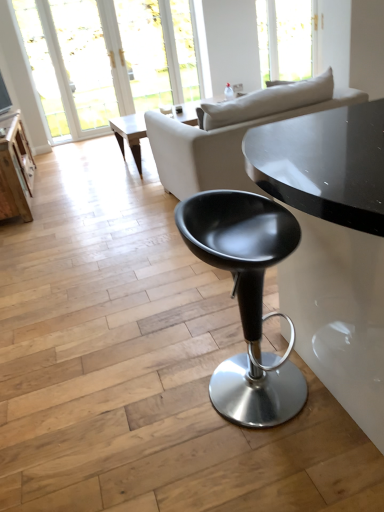
Question: Is transparent glass window at upper center further to the viewer compared to transparent glass door at upper left?

Choices:
 (A) yes
 (B) no

Answer: (A)

Question: Does transparent glass window at upper center appear on the left side of transparent glass door at upper left?

Choices:
 (A) no
 (B) yes

Answer: (A)

Question: Is transparent glass window at upper center closer to camera compared to transparent glass door at upper left?

Choices:
 (A) yes
 (B) no

Answer: (B)

Question: Considering the relative sizes of transparent glass window at upper center and transparent glass door at upper left in the image provided, is transparent glass window at upper center shorter than transparent glass door at upper left?

Choices:
 (A) no
 (B) yes

Answer: (B)

Question: Considering the relative sizes of transparent glass window at upper center and transparent glass door at upper left in the image provided, is transparent glass window at upper center bigger than transparent glass door at upper left?

Choices:
 (A) no
 (B) yes

Answer: (B)

Question: Is transparent glass window at upper center bigger or smaller than wooden table at left?

Choices:
 (A) small
 (B) big

Answer: (A)

Question: From a real-world perspective, is transparent glass window at upper center positioned above or below wooden table at left?

Choices:
 (A) above
 (B) below

Answer: (A)

Question: Considering their positions, is transparent glass window at upper center located in front of or behind wooden table at left?

Choices:
 (A) behind
 (B) front

Answer: (A)

Question: From the image's perspective, relative to wooden table at left, is transparent glass window at upper center above or below?

Choices:
 (A) above
 (B) below

Answer: (A)

Question: Does point (236, 118) appear closer or farther from the camera than point (243, 328)?

Choices:
 (A) farther
 (B) closer

Answer: (A)

Question: From a real-world perspective, is white fabric couch at upper center above or below matte black stool at center?

Choices:
 (A) below
 (B) above

Answer: (B)

Question: Based on their positions, is white fabric couch at upper center located to the left or right of matte black stool at center?

Choices:
 (A) right
 (B) left

Answer: (A)

Question: From their relative heights in the image, would you say white fabric couch at upper center is taller or shorter than matte black stool at center?

Choices:
 (A) tall
 (B) short

Answer: (A)

Question: Is white fabric couch at upper center bigger or smaller than wooden table at left?

Choices:
 (A) big
 (B) small

Answer: (A)

Question: From a real-world perspective, is white fabric couch at upper center above or below wooden table at left?

Choices:
 (A) below
 (B) above

Answer: (B)